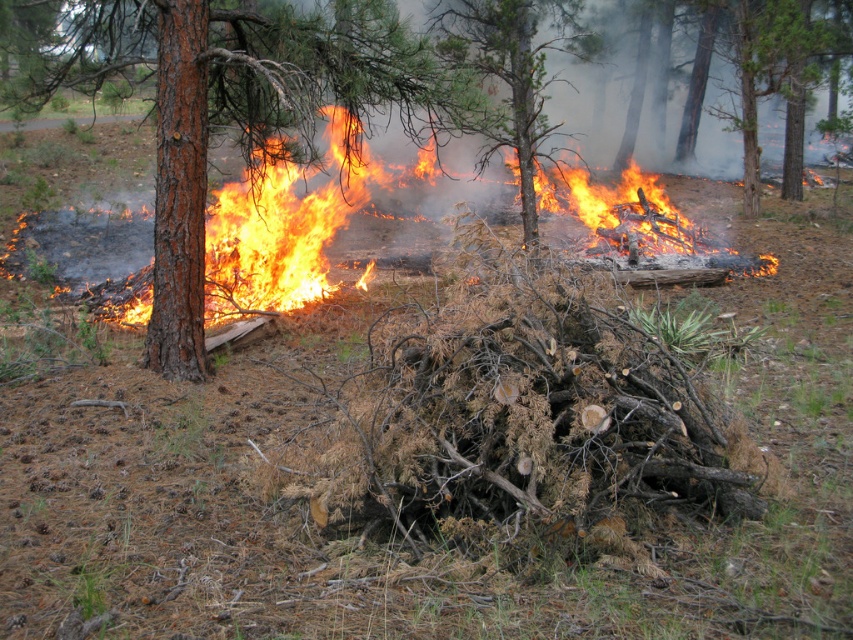
Question: Which point is farther to the camera?

Choices:
 (A) (248, 108)
 (B) (227, 250)

Answer: (B)

Question: Which point is farther to the camera?

Choices:
 (A) brown rough bark tree at left
 (B) flaming wood at center
 (C) charred wood tree at center

Answer: (C)

Question: From the image, what is the correct spatial relationship of flaming wood at center in relation to charred wood tree at center?

Choices:
 (A) left
 (B) right

Answer: (A)

Question: Can you confirm if brown rough bark tree at left is bigger than charred wood tree at center?

Choices:
 (A) yes
 (B) no

Answer: (A)

Question: Is brown rough bark tree at left wider than charred wood tree at center?

Choices:
 (A) no
 (B) yes

Answer: (B)

Question: Which of the following is the farthest from the observer?

Choices:
 (A) (402, 61)
 (B) (283, 172)

Answer: (B)